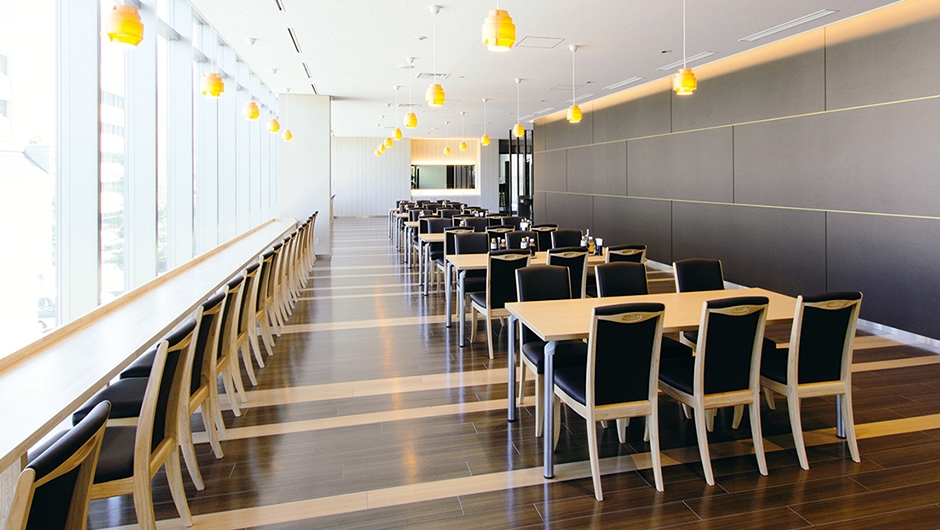
The height and width of the screenshot is (530, 940). I want to click on incoming light, so click(x=337, y=506), click(x=324, y=429), click(x=324, y=399), click(x=330, y=330), click(x=329, y=299), click(x=327, y=284), click(x=354, y=267), click(x=351, y=252), click(x=350, y=241), click(x=350, y=224).